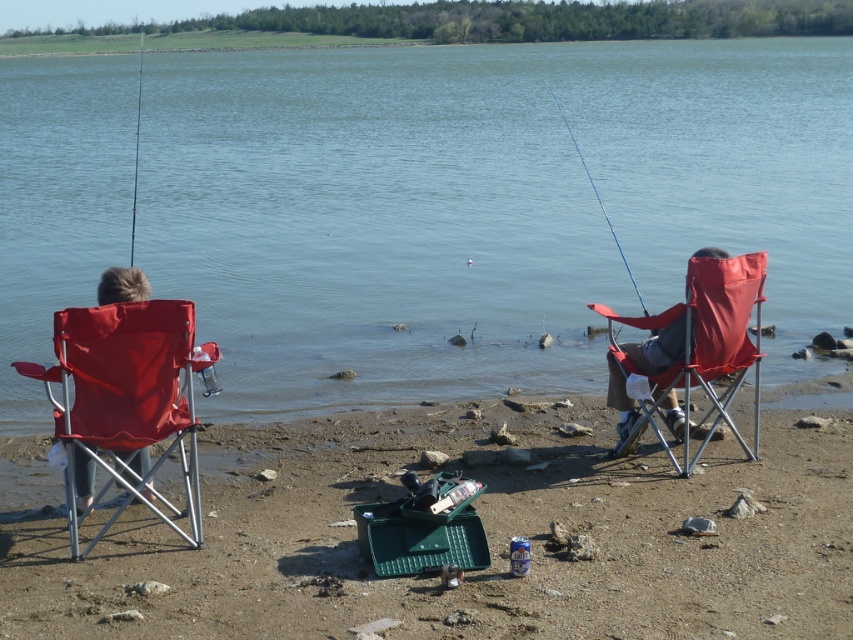
Which is below, matte red folding chair at right or blue plastic fishing pole at center?

matte red folding chair at right

Does matte red folding chair at right have a greater width compared to blue plastic fishing pole at center?

Indeed, matte red folding chair at right has a greater width compared to blue plastic fishing pole at center.

Who is more forward, (722, 269) or (549, 93)?

Point (722, 269) is more forward.

You are a GUI agent. You are given a task and a screenshot of the screen. Output one action in this format:
    pyautogui.click(x=<x>, y=<y>)
    Task: Click on the matte red folding chair at right
    The height and width of the screenshot is (640, 853).
    Given the screenshot: What is the action you would take?
    pyautogui.click(x=693, y=342)

This screenshot has width=853, height=640. What do you see at coordinates (128, 396) in the screenshot?
I see `matte plastic beach chair at left` at bounding box center [128, 396].

Can you confirm if matte plastic beach chair at left is positioned below matte red folding chair at right?

Yes, matte plastic beach chair at left is below matte red folding chair at right.

This screenshot has width=853, height=640. What do you see at coordinates (128, 396) in the screenshot?
I see `matte plastic beach chair at left` at bounding box center [128, 396].

The width and height of the screenshot is (853, 640). I want to click on matte plastic beach chair at left, so click(x=128, y=396).

Who is taller, smooth sand shoreline at lower center or metallic blue fishing pole at upper center?

Standing taller between the two is metallic blue fishing pole at upper center.

Is smooth sand shoreline at lower center shorter than metallic blue fishing pole at upper center?

Yes, smooth sand shoreline at lower center is shorter than metallic blue fishing pole at upper center.

The image size is (853, 640). Identify the location of smooth sand shoreline at lower center. (485, 531).